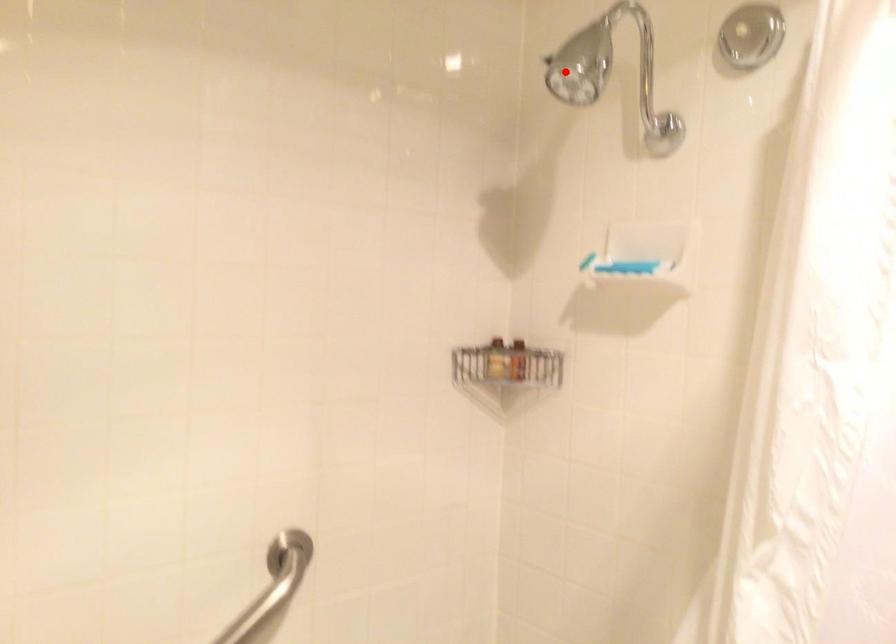
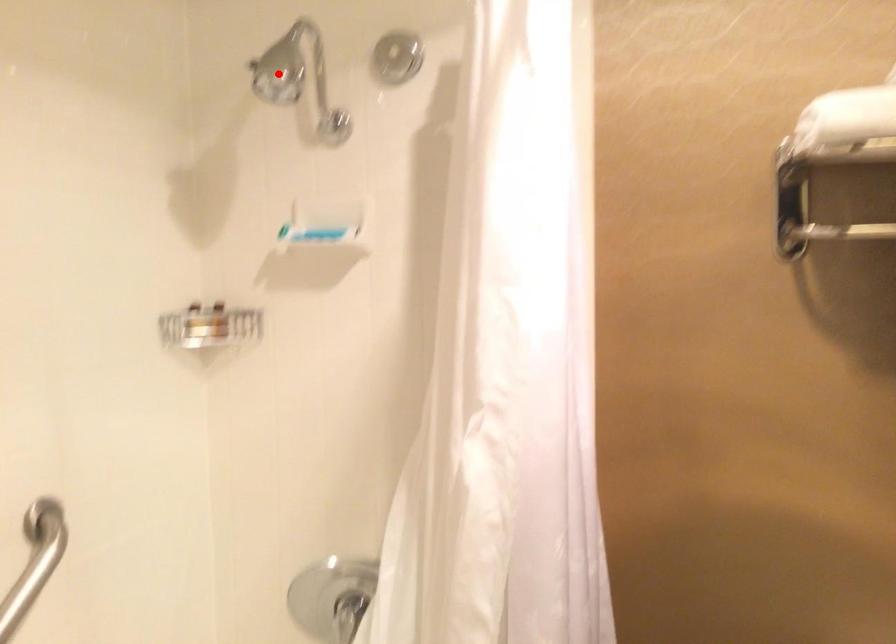
I am providing you with two images of the same scene from different viewpoints. A red point is marked on the first image and another point is marked on the second image. Do the highlighted points in image1 and image2 indicate the same real-world spot?

Yes